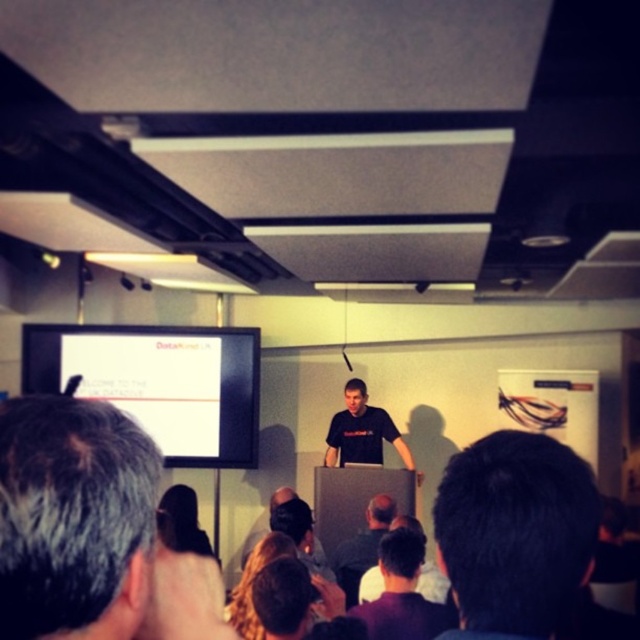
Who is more forward, (179,336) or (385,424)?

Point (385,424) is in front.

From the picture: Is white matte projection screen at upper center smaller than black matte shirt at center?

No, white matte projection screen at upper center is not smaller than black matte shirt at center.

Between point (204, 422) and point (324, 458), which one is positioned in front?

Positioned in front is point (204, 422).

Locate an element on the screen. white matte projection screen at upper center is located at coordinates (160, 381).

Which is above, gray hair at upper left or black matte shirt at center?

Positioned higher is gray hair at upper left.

Measure the distance between gray hair at upper left and black matte shirt at center.

gray hair at upper left and black matte shirt at center are 14.85 feet apart from each other.

What do you see at coordinates (92, 531) in the screenshot?
I see `gray hair at upper left` at bounding box center [92, 531].

Where is `gray hair at upper left`? gray hair at upper left is located at coordinates (92, 531).

Who is lower down, gray hair at upper left or dark brown hair at center?

dark brown hair at center

Who is taller, gray hair at upper left or dark brown hair at center?

gray hair at upper left is taller.

Where is `gray hair at upper left`? gray hair at upper left is located at coordinates (92, 531).